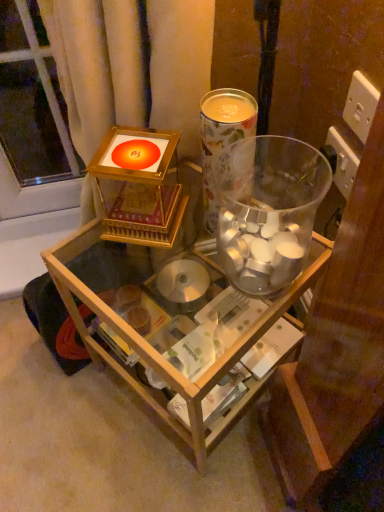
Locate an element on the screen. The width and height of the screenshot is (384, 512). floral paper cup at upper center, placed as the second beverage when sorted from bottom to top is located at coordinates (222, 136).

You are a GUI agent. You are given a task and a screenshot of the screen. Output one action in this format:
    pyautogui.click(x=<x>, y=<y>)
    Task: Click on the transparent glass vase at center, the 2th beverage from the top
    This screenshot has width=384, height=512.
    Given the screenshot: What is the action you would take?
    pyautogui.click(x=268, y=210)

How far apart are floral paper cup at upper center, placed as the first beverage when sorted from top to bottom, and transparent glass vase at center, the first beverage positioned from the bottom?

3.27 inches.

Between point (252, 101) and point (245, 280), which one is positioned in front?

The point (252, 101) is more forward.

From the image's perspective, is floral paper cup at upper center, placed as the first beverage when sorted from top to bottom, positioned above or below transparent glass vase at center, the first beverage positioned from the bottom?

floral paper cup at upper center, placed as the first beverage when sorted from top to bottom, is above transparent glass vase at center, the first beverage positioned from the bottom.

Considering the relative sizes of floral paper cup at upper center, placed as the second beverage when sorted from bottom to top, and transparent glass vase at center, the 2th beverage from the top, in the image provided, is floral paper cup at upper center, placed as the second beverage when sorted from bottom to top, shorter than transparent glass vase at center, the 2th beverage from the top,?

Incorrect, the height of floral paper cup at upper center, placed as the second beverage when sorted from bottom to top, does not fall short of that of transparent glass vase at center, the 2th beverage from the top.

Considering the positions of objects floral paper cup at upper center, placed as the second beverage when sorted from bottom to top, and transparent glass table at center in the image provided, who is more to the left, floral paper cup at upper center, placed as the second beverage when sorted from bottom to top, or transparent glass table at center?

transparent glass table at center.

Which is closer, (233, 89) or (61, 274)?

Point (233, 89) is closer to the camera than point (61, 274).

Choose the correct answer: Is floral paper cup at upper center, placed as the second beverage when sorted from bottom to top, inside transparent glass table at center or outside it?

floral paper cup at upper center, placed as the second beverage when sorted from bottom to top, is not inside transparent glass table at center, it's outside.

Looking at this image, is transparent glass table at center to the right of floral paper cup at upper center, placed as the second beverage when sorted from bottom to top, from the viewer's perspective?

No, transparent glass table at center is not to the right of floral paper cup at upper center, placed as the second beverage when sorted from bottom to top.

Is transparent glass table at center closer to the viewer compared to floral paper cup at upper center, placed as the first beverage when sorted from top to bottom?

Yes, it is.

Is transparent glass table at center not close to floral paper cup at upper center, placed as the second beverage when sorted from bottom to top?

No, there isn't a large distance between transparent glass table at center and floral paper cup at upper center, placed as the second beverage when sorted from bottom to top.

Is transparent glass table at center facing towards floral paper cup at upper center, placed as the second beverage when sorted from bottom to top?

No.

Does point (240, 335) appear closer or farther from the camera than point (226, 175)?

Clearly, point (240, 335) is closer to the camera than point (226, 175).

Based on the photo, does transparent glass table at center have a lesser height compared to transparent glass vase at center, the 2th beverage from the top?

No.

Is transparent glass table at center next to transparent glass vase at center, the 2th beverage from the top, and touching it?

They are not placed beside each other.

From the image's perspective, is transparent glass table at center above or below transparent glass vase at center, the first beverage positioned from the bottom?

transparent glass table at center is below transparent glass vase at center, the first beverage positioned from the bottom.

Consider the image. Is transparent glass vase at center, the 2th beverage from the top, bigger than floral paper cup at upper center, placed as the second beverage when sorted from bottom to top?

Yes.

I want to click on beverage above the transparent glass vase at center, the first beverage positioned from the bottom (from the image's perspective), so click(x=222, y=136).

Considering the sizes of objects transparent glass vase at center, the 2th beverage from the top, and floral paper cup at upper center, placed as the first beverage when sorted from top to bottom, in the image provided, who is shorter, transparent glass vase at center, the 2th beverage from the top, or floral paper cup at upper center, placed as the first beverage when sorted from top to bottom,?

Standing shorter between the two is transparent glass vase at center, the 2th beverage from the top.

Is the surface of transparent glass vase at center, the first beverage positioned from the bottom, in direct contact with floral paper cup at upper center, placed as the first beverage when sorted from top to bottom?

Yes, the surface of transparent glass vase at center, the first beverage positioned from the bottom, is in contact with floral paper cup at upper center, placed as the first beverage when sorted from top to bottom.

Is transparent glass table at center inside transparent glass vase at center, the 2th beverage from the top?

No, transparent glass table at center is not inside transparent glass vase at center, the 2th beverage from the top.

In the scene shown: Looking at their sizes, would you say transparent glass vase at center, the first beverage positioned from the bottom, is wider or thinner than transparent glass table at center?

Clearly, transparent glass vase at center, the first beverage positioned from the bottom, has less width compared to transparent glass table at center.

Can you confirm if transparent glass vase at center, the first beverage positioned from the bottom, is positioned to the left of transparent glass table at center?

In fact, transparent glass vase at center, the first beverage positioned from the bottom, is to the right of transparent glass table at center.

Considering the relative positions of transparent glass vase at center, the 2th beverage from the top, and transparent glass table at center in the image provided, is transparent glass vase at center, the 2th beverage from the top, behind transparent glass table at center?

No, it is not.

You are a GUI agent. You are given a task and a screenshot of the screen. Output one action in this format:
    pyautogui.click(x=<x>, y=<y>)
    Task: Click on the beverage above the transparent glass vase at center, the first beverage positioned from the bottom (from the image's perspective)
    The image size is (384, 512).
    Given the screenshot: What is the action you would take?
    pyautogui.click(x=222, y=136)

From a real-world perspective, starting from the transparent glass table at center, which beverage is the 2nd one vertically above it? Please provide its 2D coordinates.

[(222, 136)]

Which object lies further to the anchor point floral paper cup at upper center, placed as the first beverage when sorted from top to bottom, transparent glass table at center or transparent glass vase at center, the first beverage positioned from the bottom?

Among the two, transparent glass table at center is located further to floral paper cup at upper center, placed as the first beverage when sorted from top to bottom.

When comparing their distances from transparent glass vase at center, the first beverage positioned from the bottom, does transparent glass table at center or floral paper cup at upper center, placed as the second beverage when sorted from bottom to top, seem closer?

Based on the image, floral paper cup at upper center, placed as the second beverage when sorted from bottom to top, appears to be nearer to transparent glass vase at center, the first beverage positioned from the bottom.

From the image, which object appears to be farther from transparent glass vase at center, the first beverage positioned from the bottom, floral paper cup at upper center, placed as the first beverage when sorted from top to bottom, or transparent glass table at center?

Based on the image, transparent glass table at center appears to be further to transparent glass vase at center, the first beverage positioned from the bottom.

From the image, which object appears to be farther from floral paper cup at upper center, placed as the second beverage when sorted from bottom to top, transparent glass vase at center, the first beverage positioned from the bottom, or transparent glass table at center?

transparent glass table at center.

Looking at the image, which one is located further to transparent glass table at center, floral paper cup at upper center, placed as the first beverage when sorted from top to bottom, or transparent glass vase at center, the first beverage positioned from the bottom?

floral paper cup at upper center, placed as the first beverage when sorted from top to bottom, lies further to transparent glass table at center than the other object.

Estimate the real-world distances between objects in this image. Which object is closer to transparent glass table at center, transparent glass vase at center, the 2th beverage from the top, or floral paper cup at upper center, placed as the second beverage when sorted from bottom to top?

Based on the image, transparent glass vase at center, the 2th beverage from the top, appears to be nearer to transparent glass table at center.

In order to click on beverage between floral paper cup at upper center, placed as the first beverage when sorted from top to bottom, and transparent glass table at center vertically in this screenshot , I will do `click(268, 210)`.